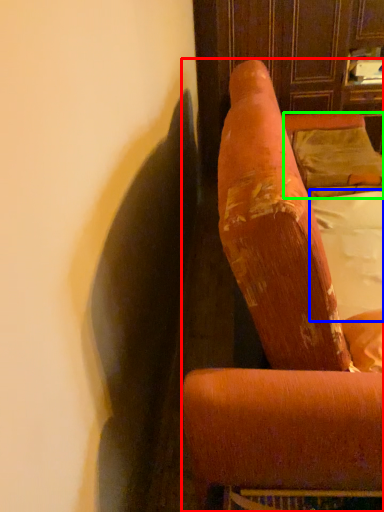
Question: Based on their relative distances, which object is farther from furniture (highlighted by a red box)? Choose from sheet (highlighted by a blue box) and pillow (highlighted by a green box).

Choices:
 (A) sheet
 (B) pillow

Answer: (B)